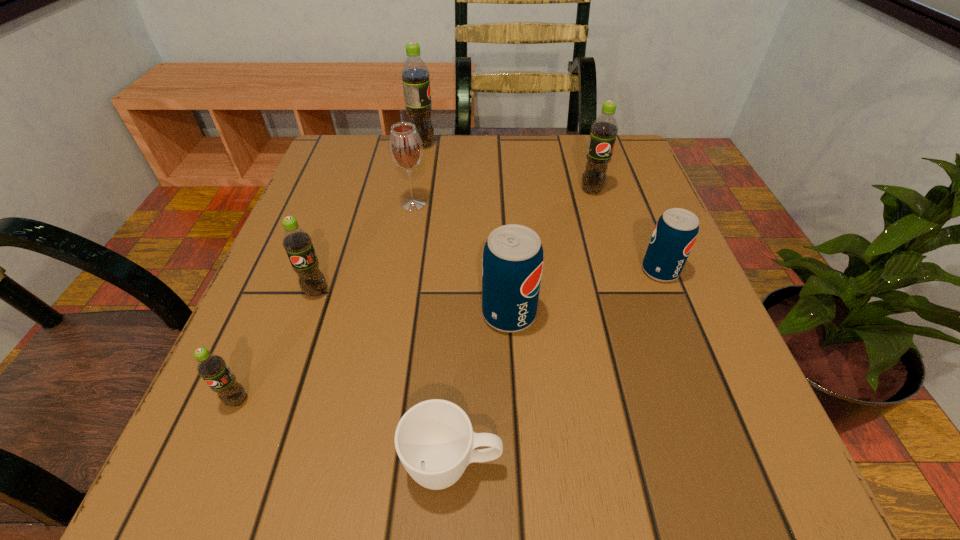
Locate which object ranks third in proximity to the tallest soda. Please provide its 2D coordinates. Your answer should be formatted as a tuple, i.e. [(x, y)], where the tuple contains the x and y coordinates of a point satisfying the conditions above.

[(297, 242)]

Locate which soda is the fourth closest to the bigger blue pop. Please provide its 2D coordinates. Your answer should be formatted as a tuple, i.e. [(x, y)], where the tuple contains the x and y coordinates of a point satisfying the conditions above.

[(211, 367)]

Select which soda appears as the fourth closest to the cup. Please provide its 2D coordinates. Your answer should be formatted as a tuple, i.e. [(x, y)], where the tuple contains the x and y coordinates of a point satisfying the conditions above.

[(675, 233)]

Locate an element on the screen. the third closest green soda to the nearest soda is located at coordinates (604, 129).

Select which green soda appears as the fourth closest to the third soda from right to left. Please provide its 2D coordinates. Your answer should be formatted as a tuple, i.e. [(x, y)], where the tuple contains the x and y coordinates of a point satisfying the conditions above.

[(415, 75)]

The width and height of the screenshot is (960, 540). I want to click on blank area in the image that satisfies the following two spatial constraints: 1. on the front label of the farthest soda; 2. on the right side of the nearer blue pop, so click(x=393, y=314).

Identify the location of blank area in the image that satisfies the following two spatial constraints: 1. on the front label of the right blue pop; 2. on the left side of the fifth nearest soda. (616, 271).

I want to click on vacant region that satisfies the following two spatial constraints: 1. on the front side of the left blue pop; 2. on the right side of the red wineglass, so click(x=394, y=314).

Find the location of a particular element. The width and height of the screenshot is (960, 540). free region that satisfies the following two spatial constraints: 1. on the front label of the bigger blue pop; 2. on the left side of the second soda from left to right is located at coordinates (308, 314).

This screenshot has height=540, width=960. Identify the location of vacant area that satisfies the following two spatial constraints: 1. on the front label of the biggest green soda; 2. on the right side of the red wineglass. (412, 204).